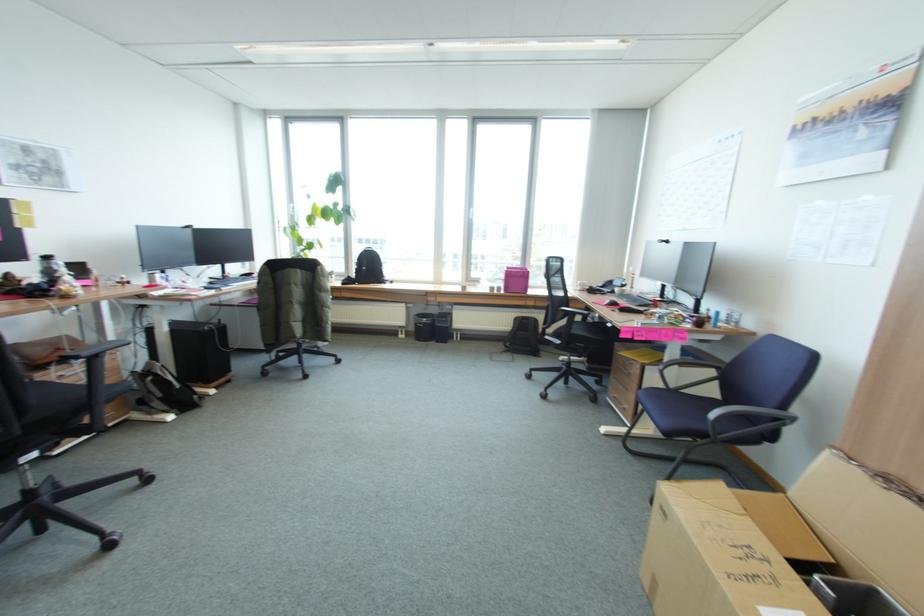
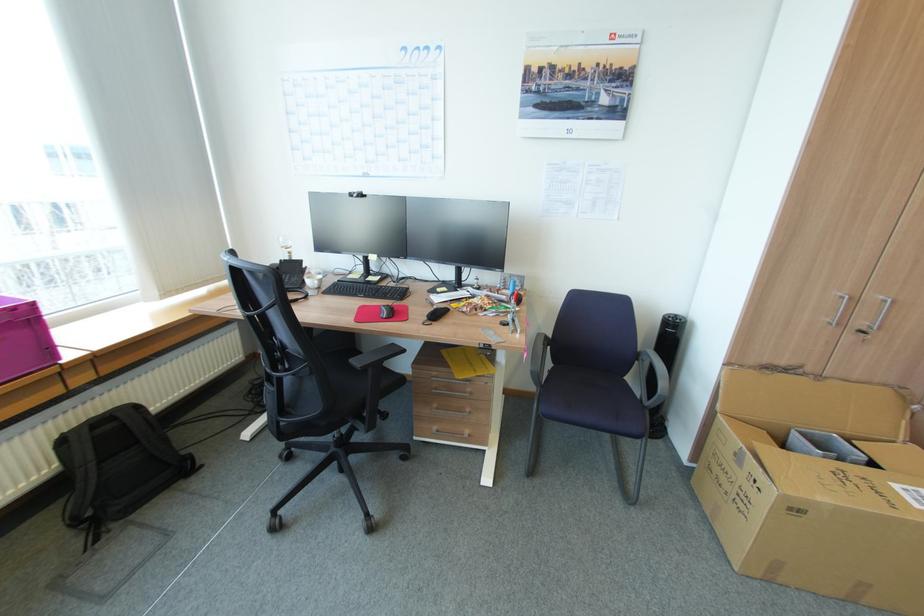
Find the pixel in the second image that matches point 631,371 in the first image.

(469, 392)